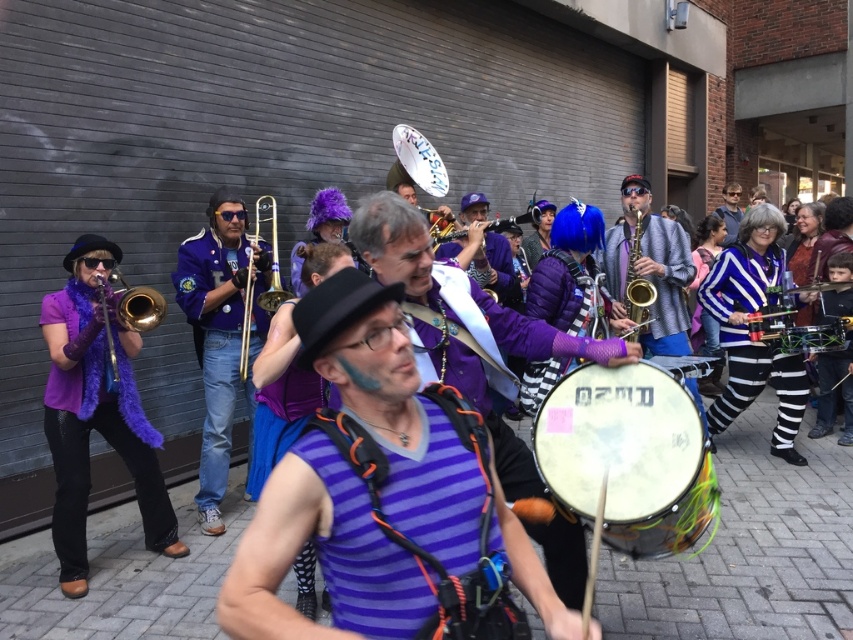
Is matte purple scarf at left to the left of purple matte trumpet at center from the viewer's perspective?

Correct, you'll find matte purple scarf at left to the left of purple matte trumpet at center.

Is point (90, 394) farther from camera compared to point (440, 250)?

No, (90, 394) is closer to viewer.

Which is behind, point (73, 436) or point (477, 211)?

The point (477, 211) is behind.

This screenshot has height=640, width=853. Find the location of `matte purple scarf at left`. matte purple scarf at left is located at coordinates (96, 410).

Is striped fabric drum at center to the left of purple matte trumpet at center from the viewer's perspective?

No, striped fabric drum at center is not to the left of purple matte trumpet at center.

Is point (761, 355) in front of point (485, 218)?

Yes, it is in front of point (485, 218).

Where is `striped fabric drum at center`? This screenshot has height=640, width=853. striped fabric drum at center is located at coordinates (747, 332).

Is purple striped tank top at center positioned behind gold brass trumpet at center?

No, it is in front of gold brass trumpet at center.

Is purple striped tank top at center above gold brass trumpet at center?

No, purple striped tank top at center is not above gold brass trumpet at center.

Who is more forward, (x=410, y=250) or (x=276, y=276)?

Positioned in front is point (x=410, y=250).

At what (x,y) coordinates should I click in order to perform the action: click on purple striped tank top at center. Please return your answer as a coordinate pair (x, y). Looking at the image, I should click on (465, 328).